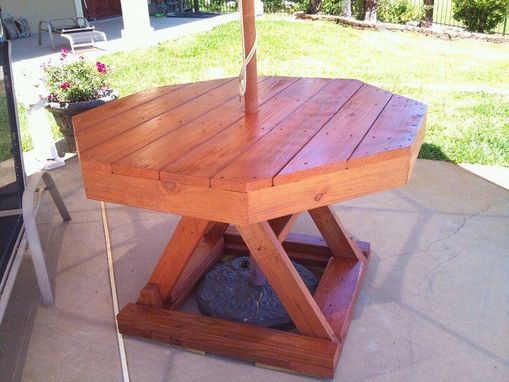
At what (x,y) coordinates should I click in order to perform the action: click on right chair legs. Please return your answer as a coordinate pair (x, y). This screenshot has height=382, width=509. Looking at the image, I should click on (43, 274), (61, 199).